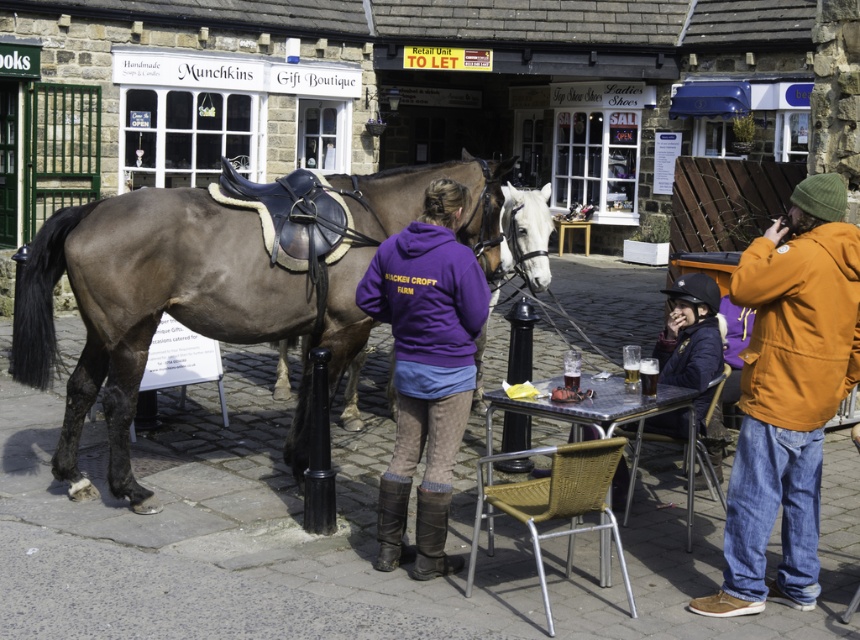
You are a photographer trying to capture both the orange fleece jacket at right and the purple fleece at center in a single frame. Which object should you focus on first to ensure both are in the shot?

The orange fleece jacket at right is larger in size than the purple fleece at center, so you should focus on the orange fleece jacket at right first to ensure both are in the shot.